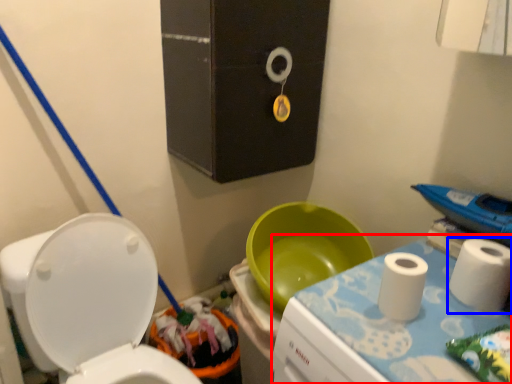
Question: Which point is further to the camera, changing table (highlighted by a red box) or toiletry (highlighted by a blue box)?

Choices:
 (A) changing table
 (B) toiletry

Answer: (B)